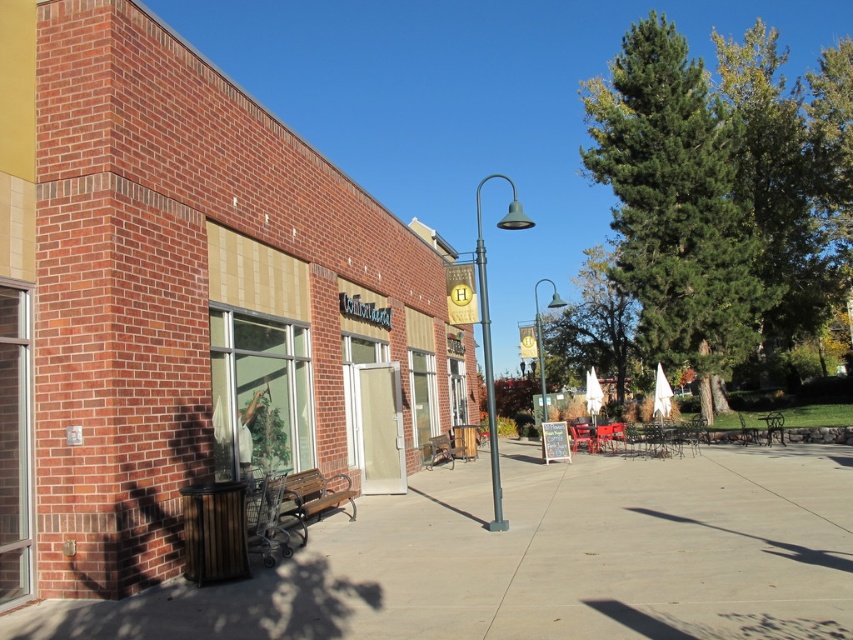
You are standing on the sidewalk in front of the brick building and want to walk to the green leafy tree at center. Which direction should you walk to avoid stepping on the smooth concrete pavement at center?

The smooth concrete pavement at center is in front of the green leafy tree at center, so to avoid stepping on it, you should walk around the tree to the side instead of going straight towards it.

You are standing on the sidewalk in front of the brick building at center and want to look at the green leafy tree at upper right. Which direction should you turn your head to see the tree?

The green leafy tree at upper right is behind the brick building at center, so you need to turn your head to the right to see it.

You are a delivery person trying to park your bike on the smooth concrete pavement at center. However, there is a green leafy tree at upper right nearby. Based on their sizes, will the tree block your bike from being fully visible from the street?

The smooth concrete pavement at center occupies less space than green leafy tree at upper right, so the larger tree might block the view of the bike parked on the smaller pavement area.